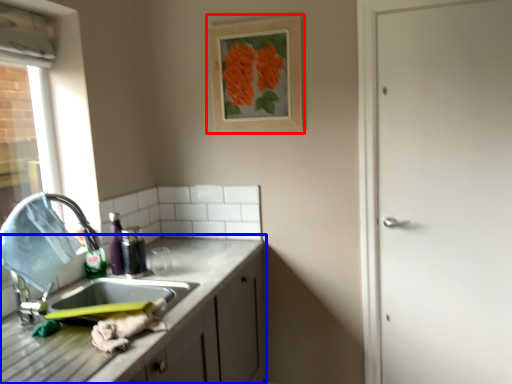
Question: Among these objects, which one is nearest to the camera, picture frame (highlighted by a red box) or cabinetry (highlighted by a blue box)?

Choices:
 (A) picture frame
 (B) cabinetry

Answer: (B)